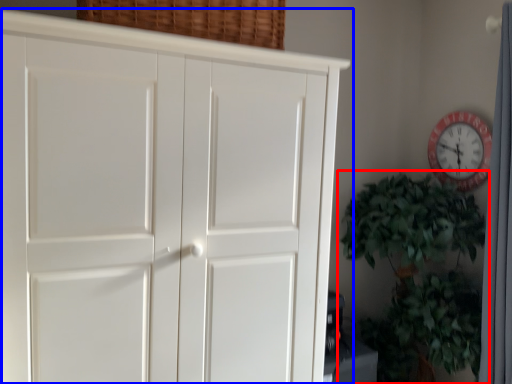
Question: Which of the following is the farthest to the observer, houseplant (highlighted by a red box) or cupboard (highlighted by a blue box)?

Choices:
 (A) houseplant
 (B) cupboard

Answer: (A)